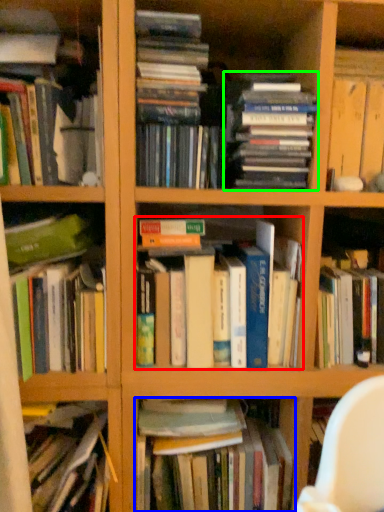
Question: Estimate the real-world distances between objects in this image. Which object is farther from book (highlighted by a red box), book (highlighted by a blue box) or book (highlighted by a green box)?

Choices:
 (A) book
 (B) book

Answer: (A)